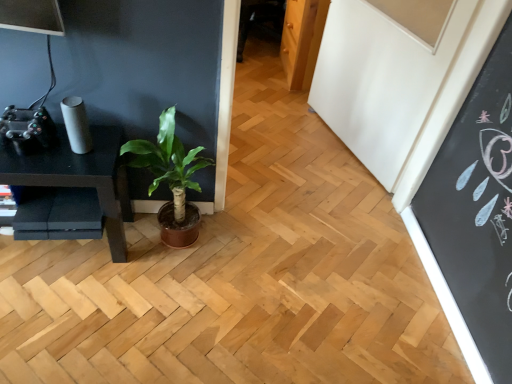
Where is `vacant area located to the right-hand side of green leafy plant at center`? The height and width of the screenshot is (384, 512). vacant area located to the right-hand side of green leafy plant at center is located at coordinates (240, 253).